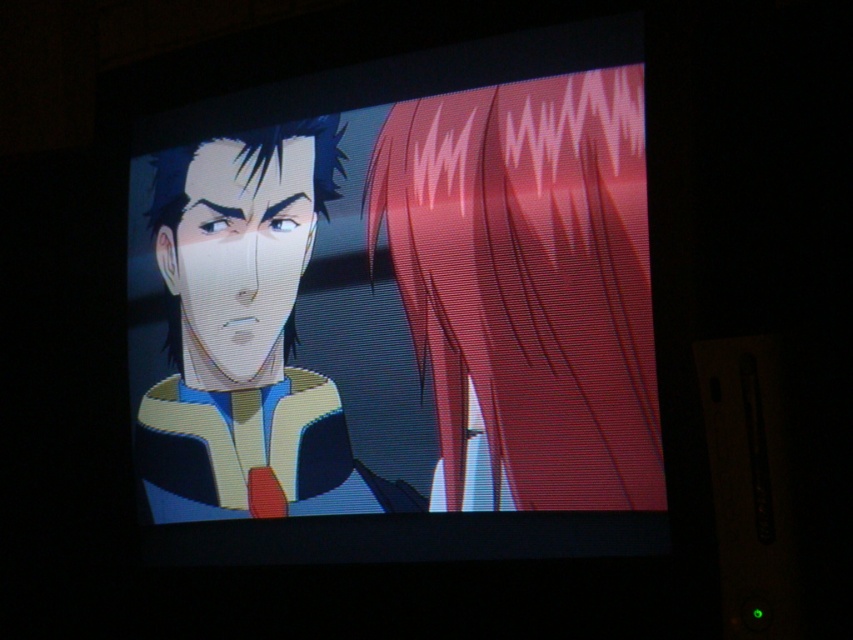
Is matte black monitor at center to the left of matte yellow jacket at left from the viewer's perspective?

Incorrect, matte black monitor at center is not on the left side of matte yellow jacket at left.

The image size is (853, 640). Identify the location of matte black monitor at center. (401, 310).

Between point (289, 248) and point (218, 310), which one is positioned in front?

Point (289, 248)

You are a GUI agent. You are given a task and a screenshot of the screen. Output one action in this format:
    pyautogui.click(x=<x>, y=<y>)
    Task: Click on the matte black monitor at center
    The height and width of the screenshot is (640, 853).
    Given the screenshot: What is the action you would take?
    pyautogui.click(x=401, y=310)